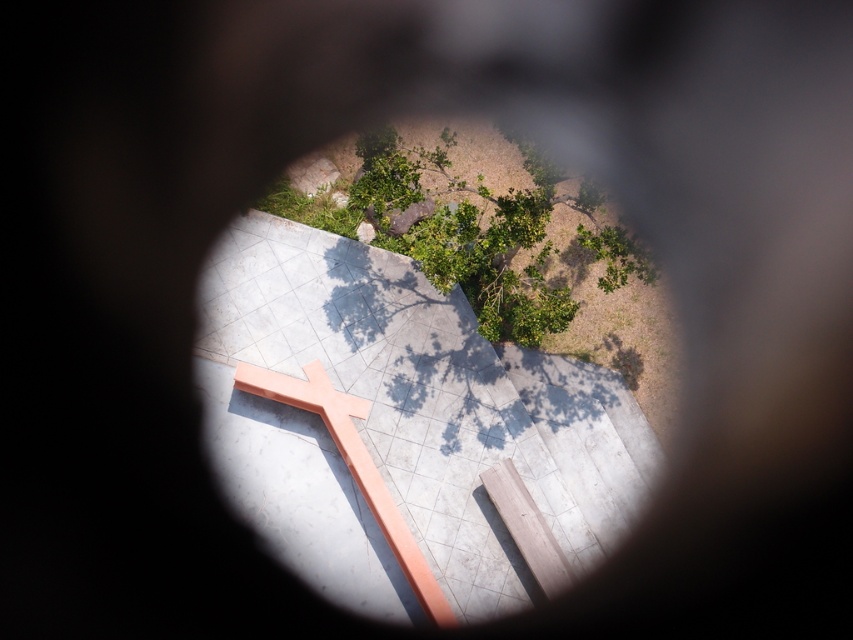
Between green leafy tree at upper center and peach wood cross at center, which one appears on the right side from the viewer's perspective?

green leafy tree at upper center

Does point (437, 182) lie behind point (329, 397)?

Yes, it is behind point (329, 397).

Does point (399, 184) come farther from viewer compared to point (335, 388)?

No, it is not.

Find the location of `green leafy tree at upper center`. green leafy tree at upper center is located at coordinates (486, 230).